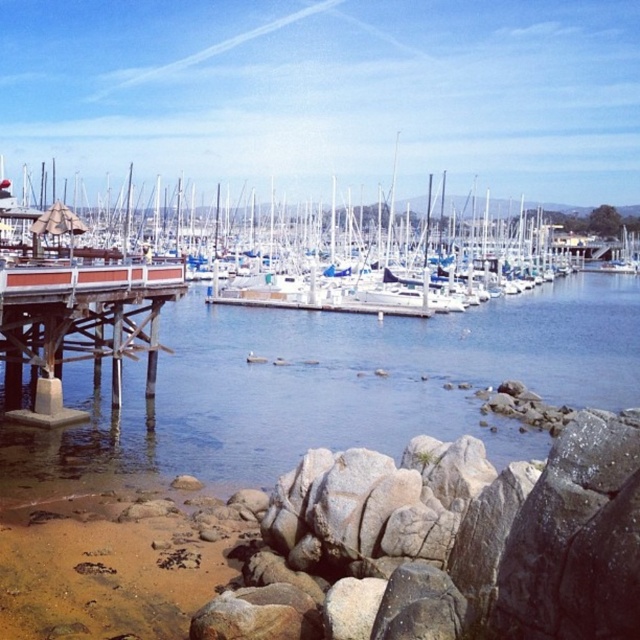
Which is behind, point (234, 349) or point (129, 355)?

Point (234, 349)

From the picture: Which is above, clear water at lower left or brown wooden dock at lower left?

clear water at lower left is higher up.

This screenshot has width=640, height=640. Describe the element at coordinates (342, 381) in the screenshot. I see `clear water at lower left` at that location.

Identify the location of clear water at lower left. This screenshot has height=640, width=640. (342, 381).

Is clear water at lower left to the left of white matte dock at left from the viewer's perspective?

Incorrect, clear water at lower left is not on the left side of white matte dock at left.

Which of these two, clear water at lower left or white matte dock at left, stands shorter?

With less height is clear water at lower left.

Which is in front, point (84, 436) or point (305, 300)?

Positioned in front is point (84, 436).

Where is `clear water at lower left`? clear water at lower left is located at coordinates (342, 381).

Can you confirm if white matte dock at left is taller than brown wooden dock at lower left?

Yes, white matte dock at left is taller than brown wooden dock at lower left.

What do you see at coordinates (264, 256) in the screenshot?
I see `white matte dock at left` at bounding box center [264, 256].

I want to click on white matte dock at left, so click(264, 256).